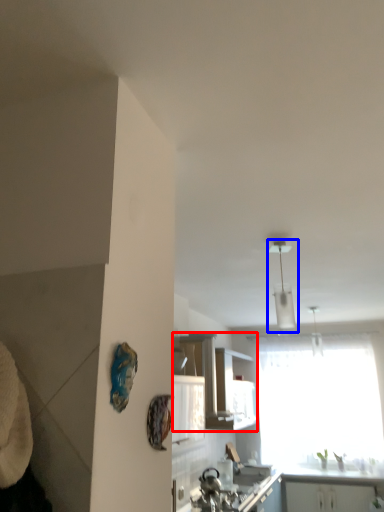
Question: Which object is closer to the camera taking this photo, cabinetry (highlighted by a red box) or light fixture (highlighted by a blue box)?

Choices:
 (A) cabinetry
 (B) light fixture

Answer: (B)